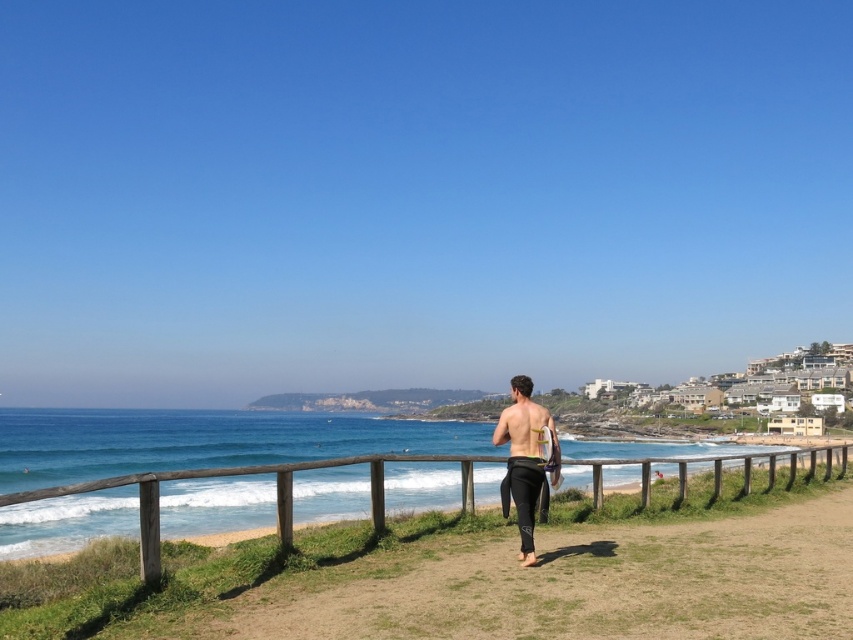
Question: In this image, where is wooden at center located relative to black wetsuit at center?

Choices:
 (A) above
 (B) below

Answer: (B)

Question: Which point is farther to the camera?

Choices:
 (A) (503, 500)
 (B) (276, 524)

Answer: (B)

Question: Can you confirm if wooden at center is smaller than black wetsuit at center?

Choices:
 (A) yes
 (B) no

Answer: (B)

Question: Can you confirm if wooden at center is positioned below black wetsuit at center?

Choices:
 (A) no
 (B) yes

Answer: (B)

Question: Which point is closer to the camera?

Choices:
 (A) black wetsuit at center
 (B) wooden at center

Answer: (B)

Question: Which point appears farthest from the camera in this image?

Choices:
 (A) (683, 483)
 (B) (509, 406)

Answer: (A)